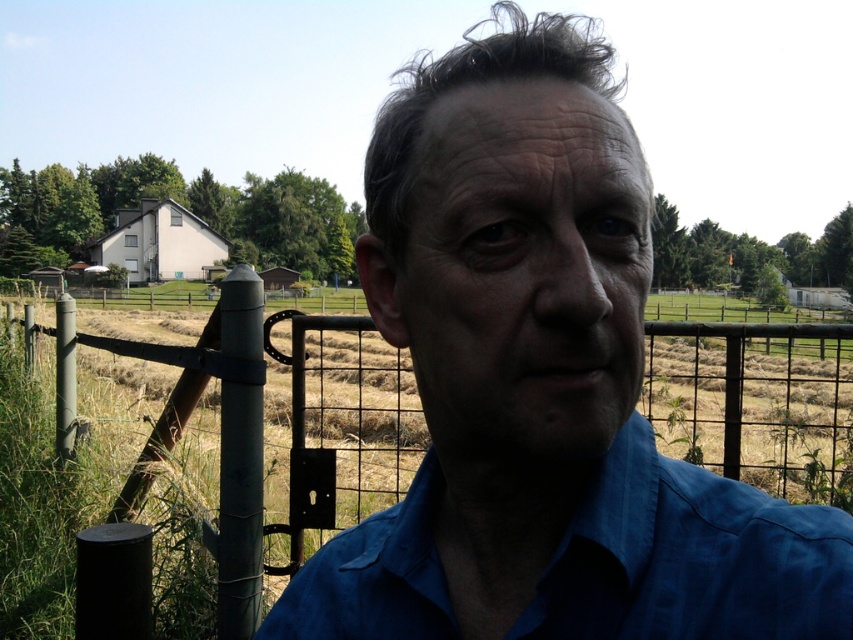
Does blue fabric shirt at center come behind metal wire fence at center?

No, blue fabric shirt at center is closer to the viewer.

Is blue fabric shirt at center thinner than metal wire fence at center?

Correct, blue fabric shirt at center's width is less than metal wire fence at center's.

Is point (614, 292) farther from camera compared to point (741, 456)?

No, it is not.

Find the location of a particular element. This screenshot has height=640, width=853. blue fabric shirt at center is located at coordinates (541, 387).